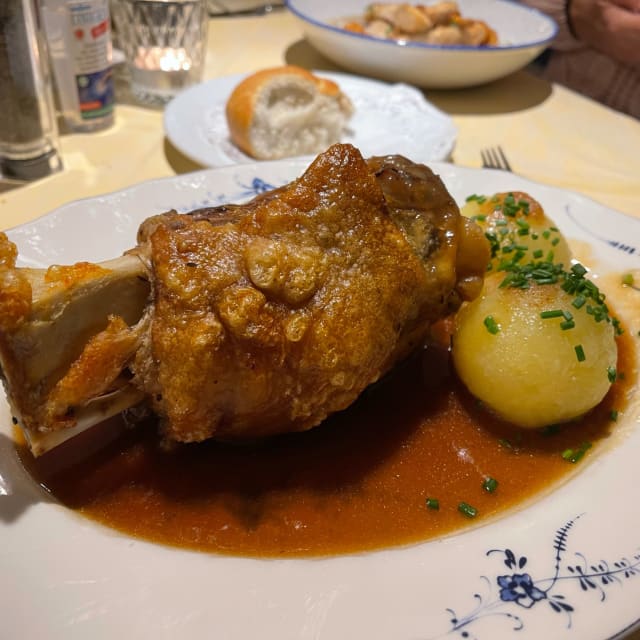
This screenshot has height=640, width=640. I want to click on bowl, so click(x=425, y=63), click(x=363, y=41), click(x=317, y=13), click(x=520, y=26).